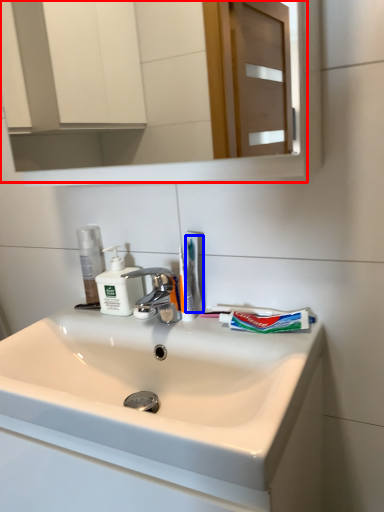
Question: Which of the following is the closest to the observer, mirror (highlighted by a red box) or toothbrush (highlighted by a blue box)?

Choices:
 (A) mirror
 (B) toothbrush

Answer: (A)